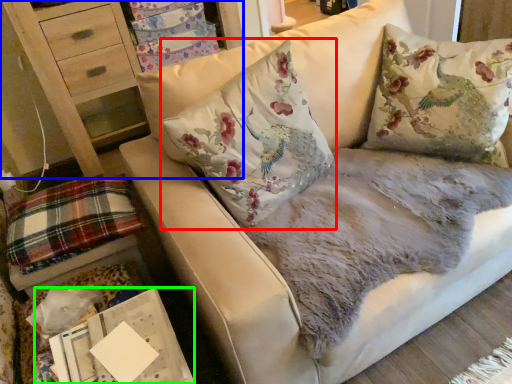
Question: Which object is positioned farthest from pillow (highlighted by a red box)? Select from furniture (highlighted by a blue box) and magazine (highlighted by a green box).

Choices:
 (A) furniture
 (B) magazine

Answer: (A)